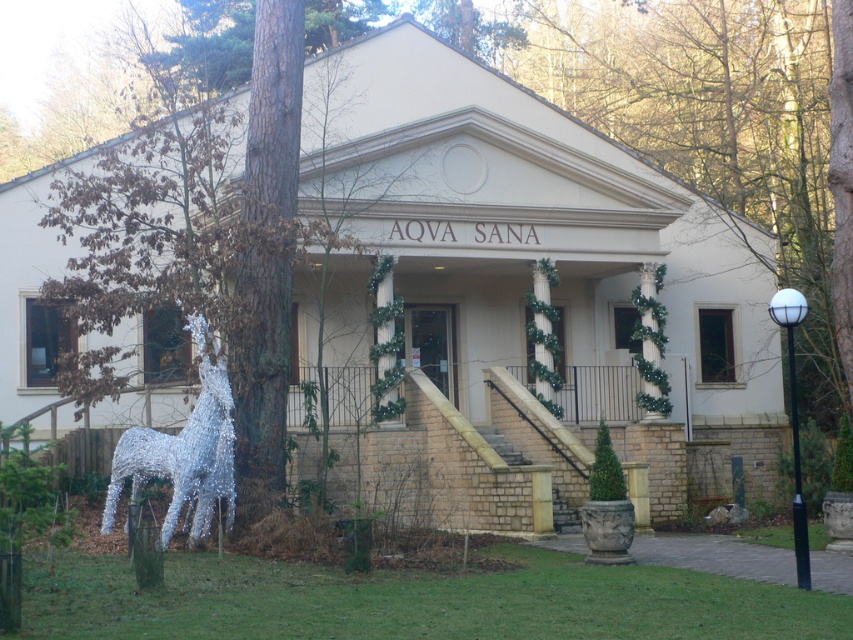
Question: Does brown textured tree at left have a lesser width compared to silver wire horse at left?

Choices:
 (A) no
 (B) yes

Answer: (B)

Question: Which of the following is the farthest from the observer?

Choices:
 (A) (167, 273)
 (B) (100, 529)

Answer: (A)

Question: Is brown textured tree at left thinner than silver wire horse at left?

Choices:
 (A) yes
 (B) no

Answer: (A)

Question: Does brown textured tree at left come behind silver wire horse at left?

Choices:
 (A) no
 (B) yes

Answer: (B)

Question: Which point is farther to the camera?

Choices:
 (A) (47, 285)
 (B) (200, 336)

Answer: (A)

Question: Which object appears farthest from the camera in this image?

Choices:
 (A) silver wire horse at left
 (B) brown textured tree at left

Answer: (B)